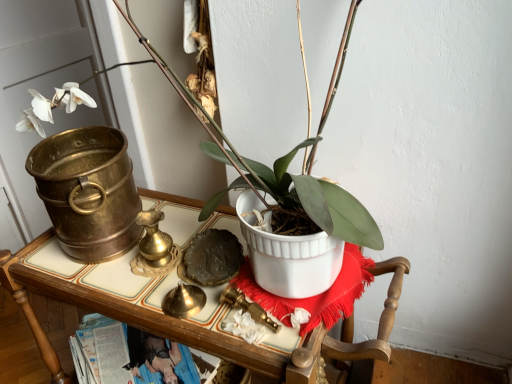
Describe the element at coordinates (197, 325) in the screenshot. I see `white ceramic pot at center` at that location.

Where is `white ceramic pot at center`? Image resolution: width=512 pixels, height=384 pixels. white ceramic pot at center is located at coordinates (197, 325).

Identify the location of white matte pot at center. The width and height of the screenshot is (512, 384). (295, 203).

What do you see at coordinates (295, 203) in the screenshot? The image size is (512, 384). I see `white matte pot at center` at bounding box center [295, 203].

Measure the distance between white matte pot at center and camera.

A distance of 24.55 inches exists between white matte pot at center and camera.

This screenshot has height=384, width=512. Find the location of `white ceramic pot at center`. white ceramic pot at center is located at coordinates (197, 325).

Visually, is white ceramic pot at center positioned to the left or to the right of white matte pot at center?

In the image, white ceramic pot at center appears on the left side of white matte pot at center.

Is white ceramic pot at center further to camera compared to white matte pot at center?

Yes, it is.

Which is closer to the camera, [155,313] or [343,196]?

The point [343,196] is in front.

From the picture: From the image's perspective, is white ceramic pot at center beneath white matte pot at center?

Yes, from the image's perspective, white ceramic pot at center is below white matte pot at center.

From a real-world perspective, is white ceramic pot at center physically located above or below white matte pot at center?

white ceramic pot at center is situated lower than white matte pot at center in the real world.

Between white ceramic pot at center and white matte pot at center, which one has smaller width?

Thinner between the two is white matte pot at center.

In terms of height, does white ceramic pot at center look taller or shorter compared to white matte pot at center?

In the image, white ceramic pot at center appears to be taller than white matte pot at center.

Can you confirm if white ceramic pot at center is bigger than white matte pot at center?

Correct, white ceramic pot at center is larger in size than white matte pot at center.

Is white ceramic pot at center surrounding white matte pot at center?

No, white matte pot at center is not surrounded by white ceramic pot at center.

Does white ceramic pot at center touch white matte pot at center?

white ceramic pot at center and white matte pot at center are not in contact.

Is white ceramic pot at center facing towards white matte pot at center?

No, white ceramic pot at center is not aimed at white matte pot at center.

What's the angular difference between white ceramic pot at center and white matte pot at center's facing directions?

They differ by 3.77 degrees in their facing directions.

Measure the distance from white ceramic pot at center to white matte pot at center.

9.29 inches.

Find the location of `furniture below the white matte pot at center (from the image's perspective)`. furniture below the white matte pot at center (from the image's perspective) is located at coordinates (197, 325).

Visually, is white matte pot at center positioned to the left or to the right of white ceramic pot at center?

Based on their positions, white matte pot at center is located to the right of white ceramic pot at center.

Which is in front, white matte pot at center or white ceramic pot at center?

white matte pot at center is in front.

Which is behind, point (307, 178) or point (259, 358)?

The point (307, 178) is more distant.

From the image's perspective, is white matte pot at center located above or below white ceramic pot at center?

Clearly, from the image's perspective, white matte pot at center is above white ceramic pot at center.

From a real-world perspective, is white matte pot at center positioned over white ceramic pot at center based on gravity?

Yes, from a real-world perspective, white matte pot at center is over white ceramic pot at center

Is white matte pot at center wider than white ceramic pot at center?

No, white matte pot at center is not wider than white ceramic pot at center.

Between white matte pot at center and white ceramic pot at center, which one has more height?

white ceramic pot at center.

Can you confirm if white matte pot at center is bigger than white ceramic pot at center?

Actually, white matte pot at center might be smaller than white ceramic pot at center.

Is white ceramic pot at center completely or partially inside white matte pot at center?

That's incorrect, white ceramic pot at center is not inside white matte pot at center.

Is white matte pot at center beside white ceramic pot at center?

No, white matte pot at center is not with white ceramic pot at center.

Is white matte pot at center positioned with its back to white ceramic pot at center?

No, white matte pot at center is not facing away from white ceramic pot at center.

How different are the orientations of white matte pot at center and white ceramic pot at center in degrees?

3.77 degrees separate the facing orientations of white matte pot at center and white ceramic pot at center.

How much distance is there between white matte pot at center and white ceramic pot at center?

white matte pot at center and white ceramic pot at center are 23.60 centimeters apart.

Where is `houseplant above the white ceramic pot at center (from the image's perspective)`? houseplant above the white ceramic pot at center (from the image's perspective) is located at coordinates (295, 203).

Identify the location of houseplant above the white ceramic pot at center (from a real-world perspective). (295, 203).

Identify the location of houseplant in front of the white ceramic pot at center. This screenshot has height=384, width=512. (295, 203).